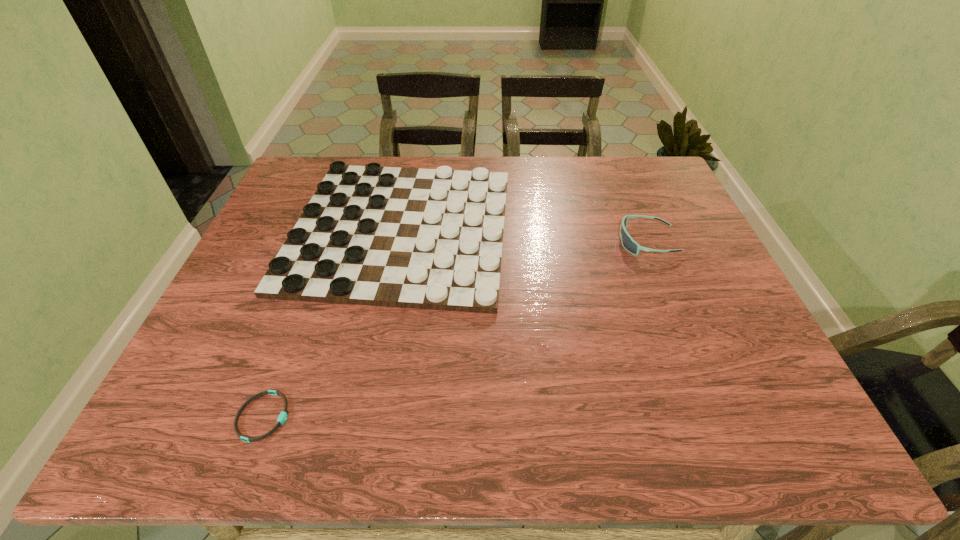
Locate an element on the screen. free region at the right edge is located at coordinates (699, 269).

Identify the location of vacant space at the far right corner of the desktop. (653, 184).

You are a GUI agent. You are given a task and a screenshot of the screen. Output one action in this format:
    pyautogui.click(x=<x>, y=<y>)
    Task: Click on the free space at the near right corner of the desktop
    
    Given the screenshot: What is the action you would take?
    pyautogui.click(x=773, y=429)

Find the location of a particular element. vacant area between the nearest object and the second shortest object is located at coordinates (332, 323).

This screenshot has width=960, height=540. I want to click on unoccupied position between the gameboard and the nearest object, so click(x=332, y=323).

Identify the location of free space between the rightmost object and the shortest object. Image resolution: width=960 pixels, height=540 pixels. (455, 329).

Find the location of a particular element. The width and height of the screenshot is (960, 540). free space between the shortest object and the rightmost object is located at coordinates click(x=455, y=329).

Locate an element on the screen. vacant area that lies between the rightmost object and the second shortest object is located at coordinates (524, 235).

This screenshot has width=960, height=540. What are the coordinates of `vacant point located between the shortest object and the tallest object` in the screenshot? It's located at (455, 329).

Locate an element on the screen. The height and width of the screenshot is (540, 960). vacant area between the gameboard and the shortest object is located at coordinates (332, 323).